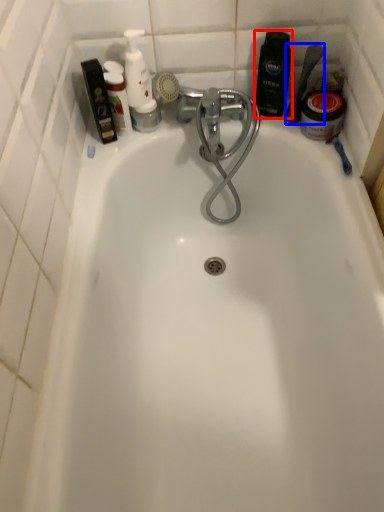
Question: Which object is closer to the camera taking this photo, toiletry (highlighted by a red box) or shower (highlighted by a blue box)?

Choices:
 (A) toiletry
 (B) shower

Answer: (B)